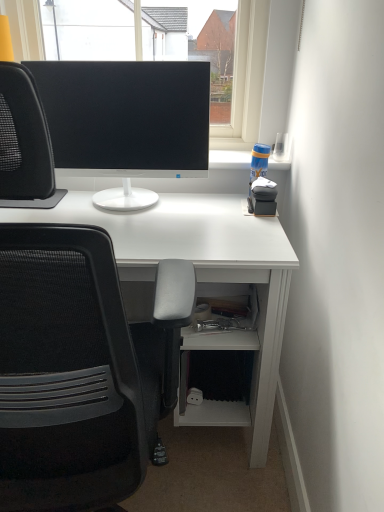
Identify the location of vacant region to the right of matte black monitor at center. (208, 214).